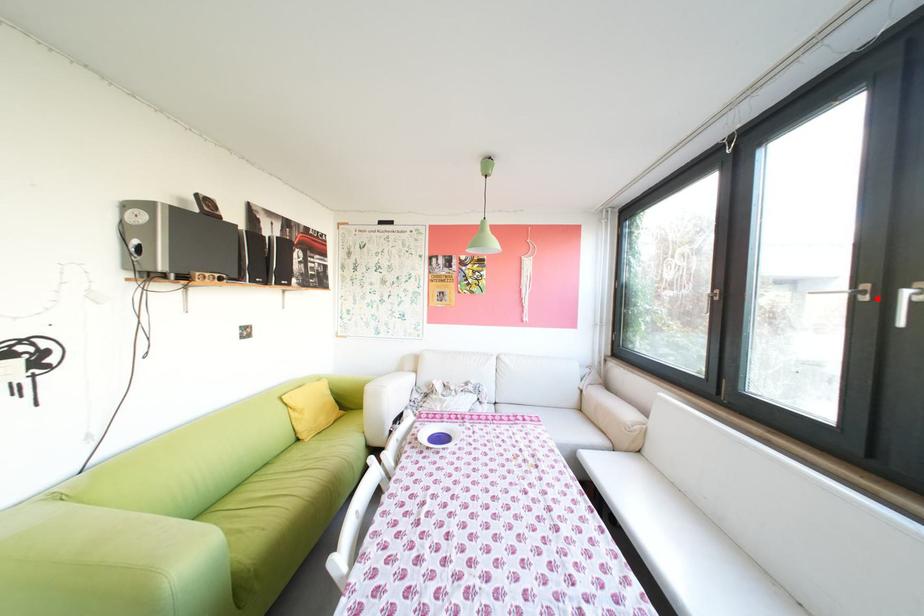
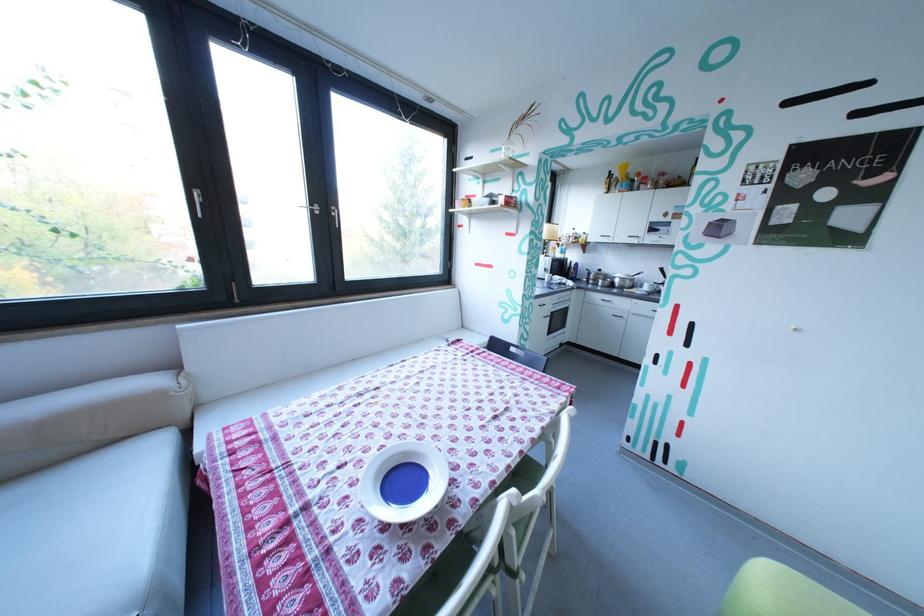
Question: I am providing you with two images of the same scene from different viewpoints. Image1 has a red point marked. In image2, the corresponding 3D location appears at what relative position? Reply with the corresponding letter.

Choices:
 (A) Closer
 (B) Farther

Answer: (A)